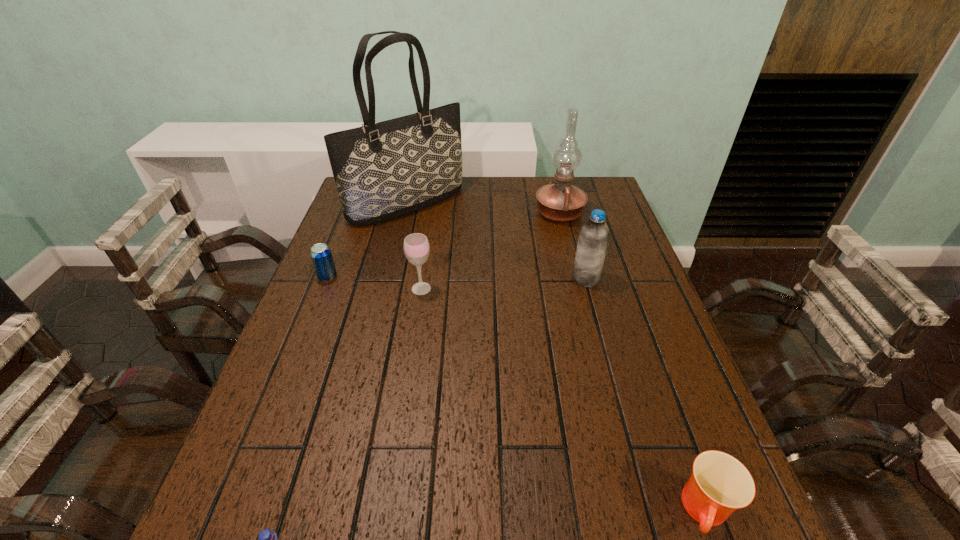
You are a GUI agent. You are given a task and a screenshot of the screen. Output one action in this format:
    pyautogui.click(x=<x>, y=<y>)
    Task: Click on the tote bag at the far edge
    This screenshot has height=540, width=960.
    Given the screenshot: What is the action you would take?
    pyautogui.click(x=383, y=170)

Locate an element on the screen. oil lamp present at the far edge is located at coordinates (561, 202).

Identify the location of tote bag that is at the left edge. (383, 170).

The width and height of the screenshot is (960, 540). I want to click on beer can present at the left edge, so click(321, 255).

Find the location of `oil lamp present at the right edge`. oil lamp present at the right edge is located at coordinates (561, 202).

Where is `water bottle at the right edge`? The image size is (960, 540). water bottle at the right edge is located at coordinates tap(593, 239).

Identify the location of object that is at the far left corner. The image size is (960, 540). (383, 170).

Image resolution: width=960 pixels, height=540 pixels. I want to click on object at the far right corner, so click(x=561, y=202).

In order to click on vacant space at the far edge in this screenshot , I will do `click(531, 200)`.

Image resolution: width=960 pixels, height=540 pixels. Find the location of `free space at the near edge`. free space at the near edge is located at coordinates (498, 523).